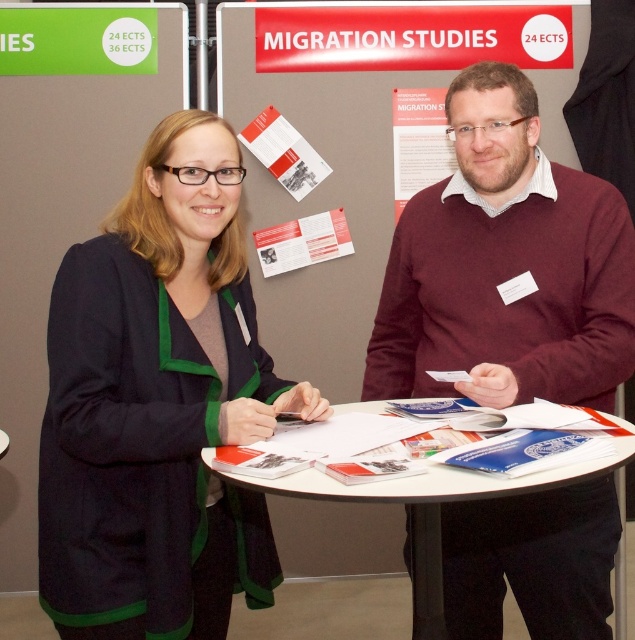
Is red glossy poster at upper center to the right of white paper poster at upper center from the viewer's perspective?

Incorrect, red glossy poster at upper center is not on the right side of white paper poster at upper center.

Is red glossy poster at upper center to the left of white paper poster at upper center from the viewer's perspective?

Correct, you'll find red glossy poster at upper center to the left of white paper poster at upper center.

Image resolution: width=635 pixels, height=640 pixels. Describe the element at coordinates (410, 36) in the screenshot. I see `red glossy poster at upper center` at that location.

Identify the location of red glossy poster at upper center. (410, 36).

Measure the distance between red glossy poster at upper center and camera.

2.64 meters

Does red glossy poster at upper center have a larger size compared to green matte sign at upper left?

Indeed, red glossy poster at upper center has a larger size compared to green matte sign at upper left.

In order to click on red glossy poster at upper center in this screenshot , I will do `click(410, 36)`.

Can you confirm if matte paper poster at center is positioned to the right of matte paper brochure at center?

Correct, you'll find matte paper poster at center to the right of matte paper brochure at center.

In the scene shown: Is matte paper poster at center further to the viewer compared to matte paper brochure at center?

No, it is in front of matte paper brochure at center.

Identify the location of matte paper poster at center. (x=349, y=170).